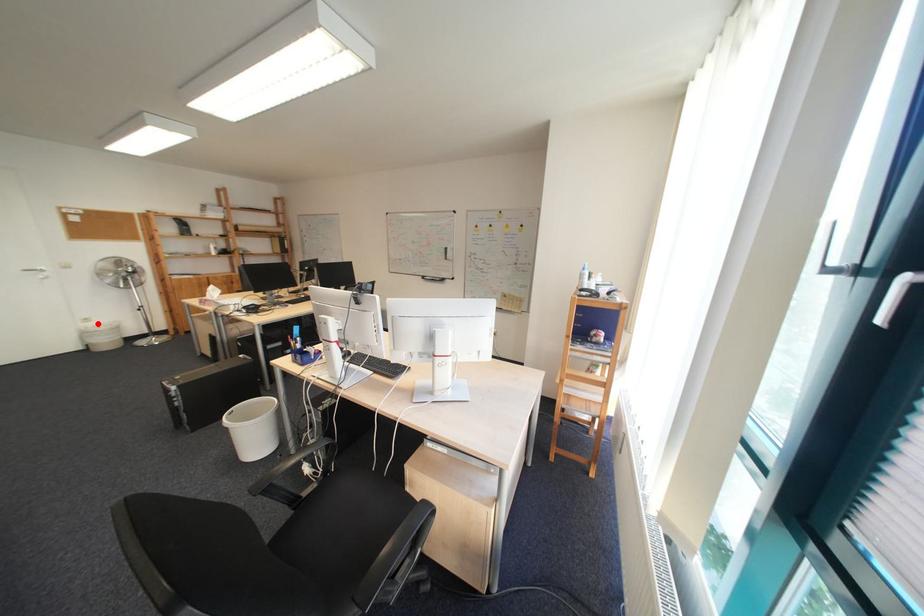
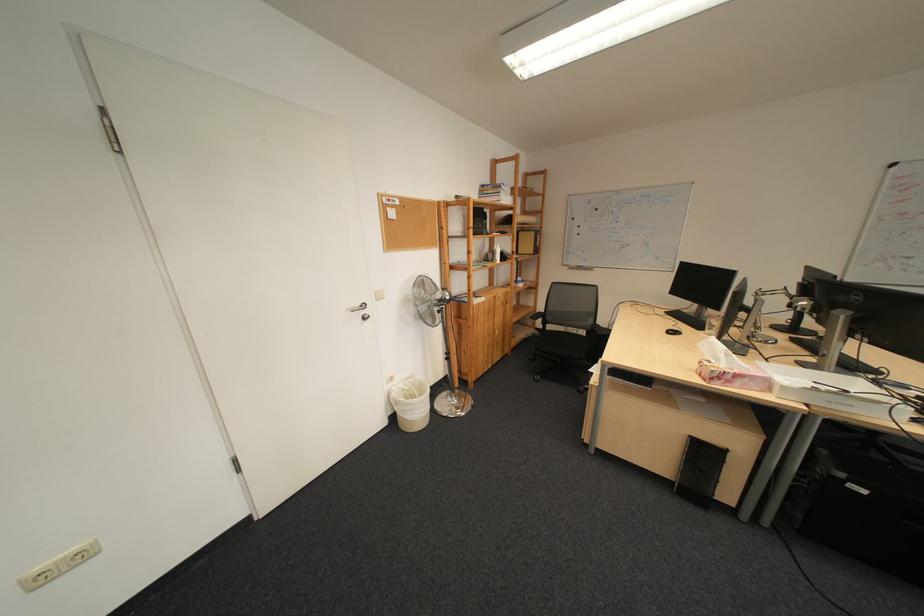
Question: I am providing you with two images of the same scene from different viewpoints. In image1, a red point is highlighted. Considering the same 3D point in image2, which of the following is correct?

Choices:
 (A) It is closer
 (B) It is farther

Answer: (A)